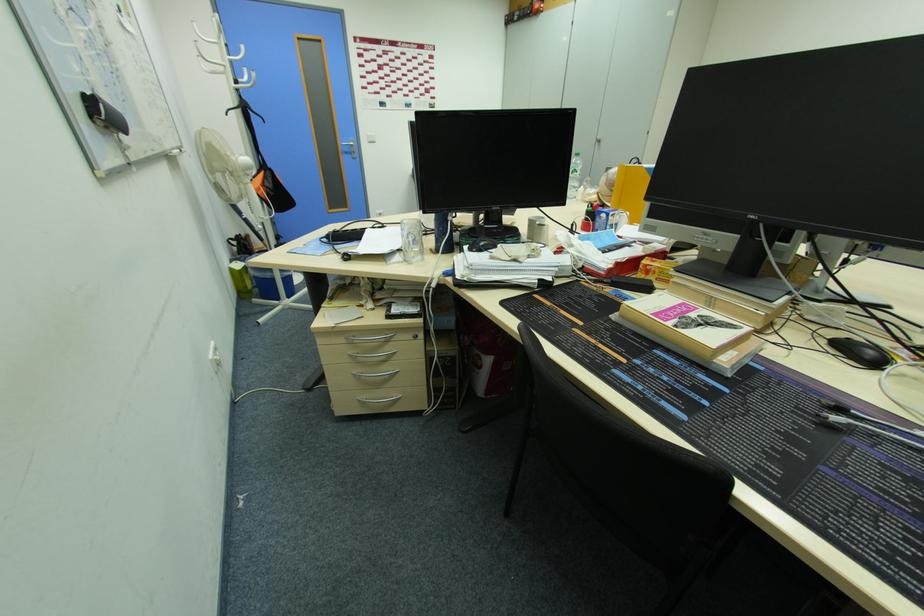
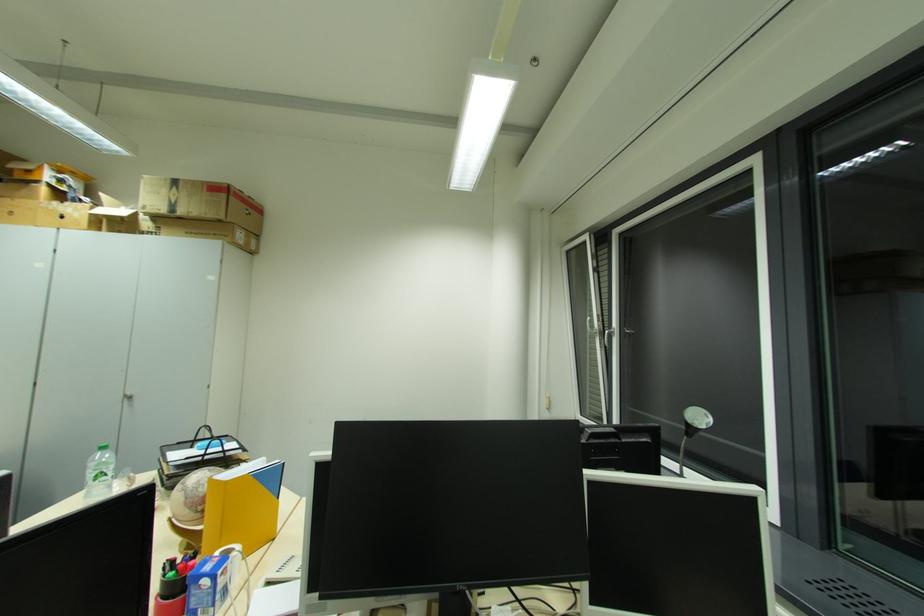
The point at (600, 145) is marked in the first image. Where is the corresponding point in the second image?

(128, 400)